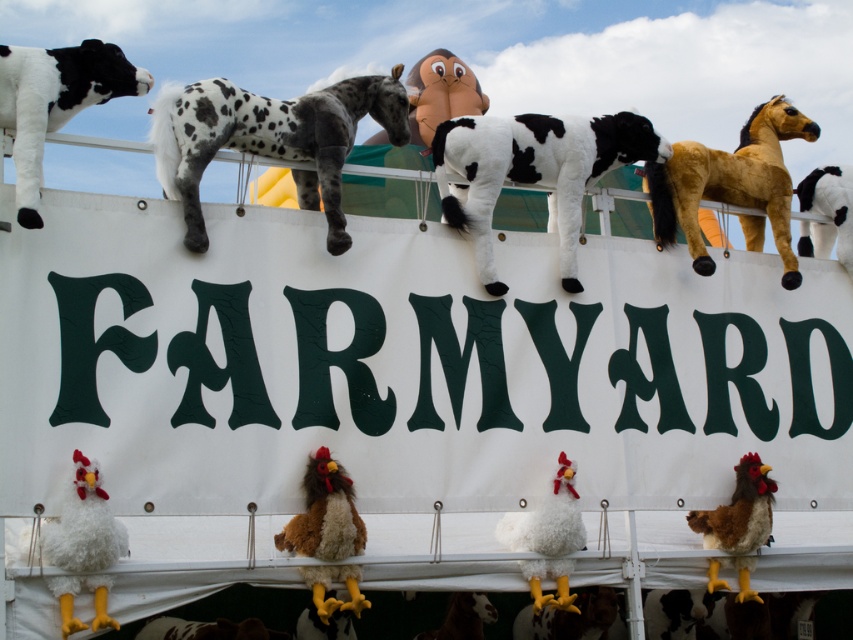
You are setting up a farmyard display and need to arrange two white fluffy chickens. The banner has limited space. Given that the white fluffy chicken at lower left and the white fluffy chicken at lower center are available, which chicken should you choose to place on the banner if you want the wider chicken?

The white fluffy chicken at lower center should be chosen because its width is greater than the white fluffy chicken at lower left.

You are standing in front of the farmyard display and want to hang a new plush toy. The display has two points marked at coordinates point (340, 100) and point (39, 104). Which point is closer to you?

Point (39, 104) is closer to you because it is in front of point (340, 100).